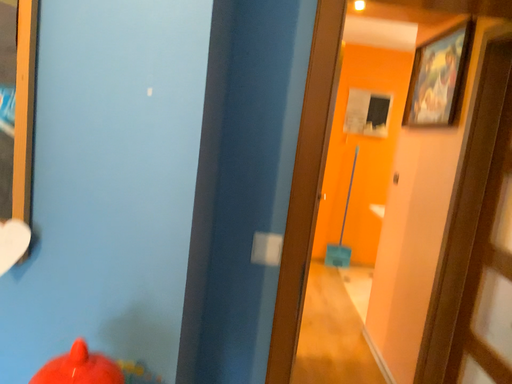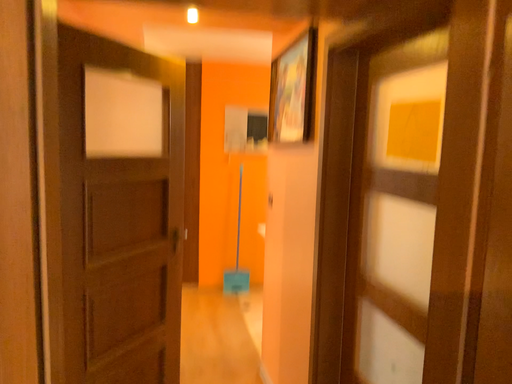
Question: How did the camera likely rotate when shooting the video?

Choices:
 (A) rotated left
 (B) rotated right

Answer: (B)